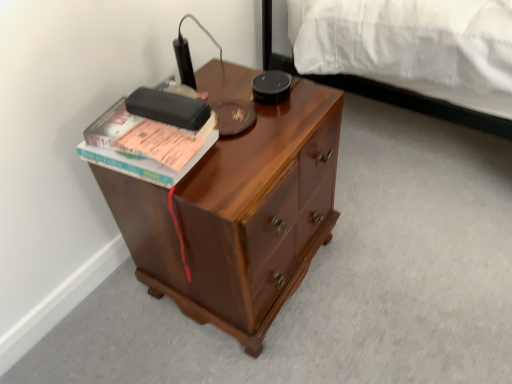
Question: Is point (175, 130) positioned closer to the camera than point (306, 160)?

Choices:
 (A) closer
 (B) farther

Answer: (A)

Question: Considering the positions of hardcover book at upper left and shiny brown wooden desk at center in the image, is hardcover book at upper left wider or thinner than shiny brown wooden desk at center?

Choices:
 (A) thin
 (B) wide

Answer: (A)

Question: Is hardcover book at upper left taller or shorter than shiny brown wooden desk at center?

Choices:
 (A) tall
 (B) short

Answer: (B)

Question: Considering the positions of point (224, 61) and point (104, 134), is point (224, 61) closer or farther from the camera than point (104, 134)?

Choices:
 (A) farther
 (B) closer

Answer: (A)

Question: Considering their positions, is shiny brown wooden desk at center located in front of or behind hardcover book at upper left?

Choices:
 (A) front
 (B) behind

Answer: (A)

Question: From a real-world perspective, is shiny brown wooden desk at center physically located above or below hardcover book at upper left?

Choices:
 (A) above
 (B) below

Answer: (B)

Question: In the image, is shiny brown wooden desk at center on the left side or the right side of hardcover book at upper left?

Choices:
 (A) right
 (B) left

Answer: (A)